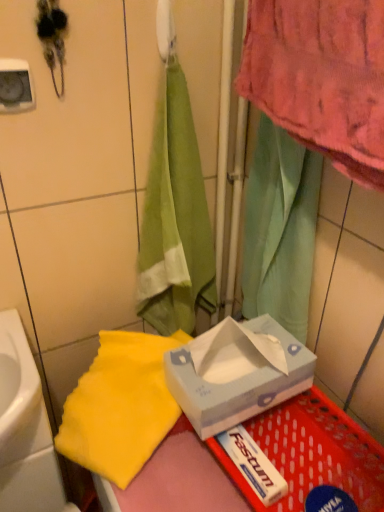
Question: Is white paper tissue box at center located outside white glossy sink at lower left?

Choices:
 (A) yes
 (B) no

Answer: (A)

Question: Can you confirm if white paper tissue box at center is shorter than white glossy sink at lower left?

Choices:
 (A) no
 (B) yes

Answer: (B)

Question: From a real-world perspective, is white paper tissue box at center over white glossy sink at lower left?

Choices:
 (A) yes
 (B) no

Answer: (A)

Question: Is white paper tissue box at center smaller than white glossy sink at lower left?

Choices:
 (A) yes
 (B) no

Answer: (A)

Question: Is white paper tissue box at center positioned with its back to white glossy sink at lower left?

Choices:
 (A) yes
 (B) no

Answer: (B)

Question: Can you confirm if white paper tissue box at center is thinner than white glossy sink at lower left?

Choices:
 (A) yes
 (B) no

Answer: (B)

Question: Is white glossy sink at lower left to the left of yellow fabric towel at lower left from the viewer's perspective?

Choices:
 (A) yes
 (B) no

Answer: (A)

Question: Can you confirm if white glossy sink at lower left is bigger than yellow fabric towel at lower left?

Choices:
 (A) no
 (B) yes

Answer: (B)

Question: Considering the relative sizes of white glossy sink at lower left and yellow fabric towel at lower left in the image provided, is white glossy sink at lower left smaller than yellow fabric towel at lower left?

Choices:
 (A) no
 (B) yes

Answer: (A)

Question: Is white glossy sink at lower left positioned beyond the bounds of yellow fabric towel at lower left?

Choices:
 (A) yes
 (B) no

Answer: (A)

Question: Is white glossy sink at lower left thinner than yellow fabric towel at lower left?

Choices:
 (A) yes
 (B) no

Answer: (A)

Question: From a real-world perspective, is white glossy sink at lower left physically below yellow fabric towel at lower left?

Choices:
 (A) yes
 (B) no

Answer: (A)

Question: Is white glossy sink at lower left shorter than white paper tissue box at center?

Choices:
 (A) no
 (B) yes

Answer: (A)